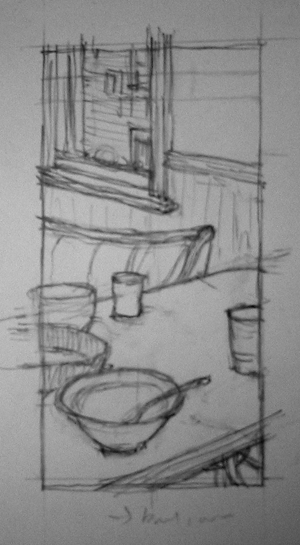
I want to click on dining table, so click(189, 307).